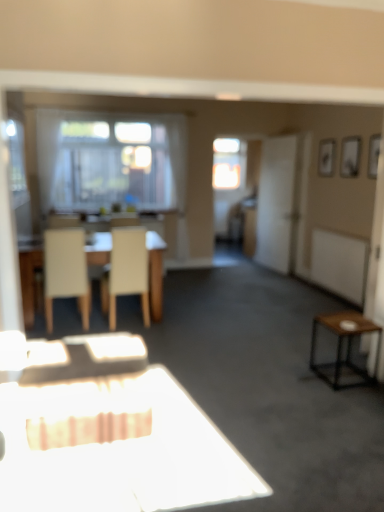
Question: Does light beige wood table at center lie in front of transparent glass window at center?

Choices:
 (A) yes
 (B) no

Answer: (A)

Question: Is light beige wood table at center facing away from transparent glass window at center?

Choices:
 (A) yes
 (B) no

Answer: (B)

Question: Can you confirm if light beige wood table at center is smaller than transparent glass window at center?

Choices:
 (A) yes
 (B) no

Answer: (B)

Question: Does light beige wood table at center touch transparent glass window at center?

Choices:
 (A) no
 (B) yes

Answer: (A)

Question: From the image's perspective, does light beige wood table at center appear lower than transparent glass window at center?

Choices:
 (A) yes
 (B) no

Answer: (A)

Question: From the image's perspective, is white matte screen door at right positioned above or below white matte chair at left, marked as the first chair in a left-to-right arrangement?

Choices:
 (A) above
 (B) below

Answer: (A)

Question: In terms of width, does white matte screen door at right look wider or thinner when compared to white matte chair at left, marked as the first chair in a left-to-right arrangement?

Choices:
 (A) thin
 (B) wide

Answer: (A)

Question: In the image, is white matte screen door at right on the left side or the right side of white matte chair at left, marked as the first chair in a left-to-right arrangement?

Choices:
 (A) right
 (B) left

Answer: (A)

Question: Would you say white matte screen door at right is inside or outside white matte chair at left, which appears as the second chair when viewed from the right?

Choices:
 (A) inside
 (B) outside

Answer: (B)

Question: Is white matte chair at left, which appears as the second chair when viewed from the right, taller or shorter than transparent glass window at center?

Choices:
 (A) short
 (B) tall

Answer: (A)

Question: From the image's perspective, is white matte chair at left, marked as the first chair in a left-to-right arrangement, positioned above or below transparent glass window at center?

Choices:
 (A) below
 (B) above

Answer: (A)

Question: In the image, is white matte chair at left, which appears as the second chair when viewed from the right, positioned in front of or behind transparent glass window at center?

Choices:
 (A) behind
 (B) front

Answer: (B)

Question: Looking at their shapes, would you say white matte chair at left, marked as the first chair in a left-to-right arrangement, is wider or thinner than transparent glass window at center?

Choices:
 (A) wide
 (B) thin

Answer: (A)

Question: From the image's perspective, relative to beige fabric chair at center, which ranks as the second chair in left-to-right order, is transparent glass window at center above or below?

Choices:
 (A) above
 (B) below

Answer: (A)

Question: Considering their positions, is transparent glass window at center located in front of or behind beige fabric chair at center, which ranks as the second chair in left-to-right order?

Choices:
 (A) behind
 (B) front

Answer: (A)